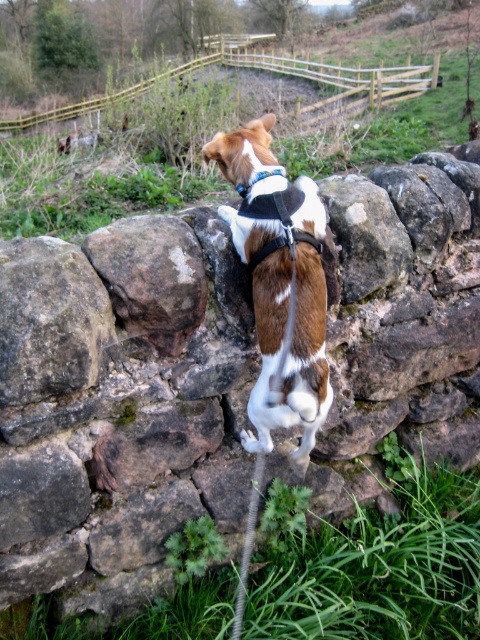
Between brown and white fur at upper center and brown rough stone at center, which one is positioned lower?

brown and white fur at upper center

Is point (305, 308) farther from viewer compared to point (143, 256)?

No, it is in front of (143, 256).

Where is `brown and white fur at upper center`? This screenshot has width=480, height=640. brown and white fur at upper center is located at coordinates (285, 307).

Who is more distant from viewer, (304, 234) or (237, 186)?

Point (237, 186)

Consider the image. Is brown and white fur at upper center behind blue fabric neckband at upper center?

No.

Measure the distance between brown and white fur at upper center and camera.

They are 1.84 meters apart.

The image size is (480, 640). Identify the location of brown and white fur at upper center. (285, 307).

Who is higher up, brown rough stone at center or blue fabric neckband at upper center?

blue fabric neckband at upper center

Find the location of a particular element. The height and width of the screenshot is (640, 480). brown rough stone at center is located at coordinates (152, 276).